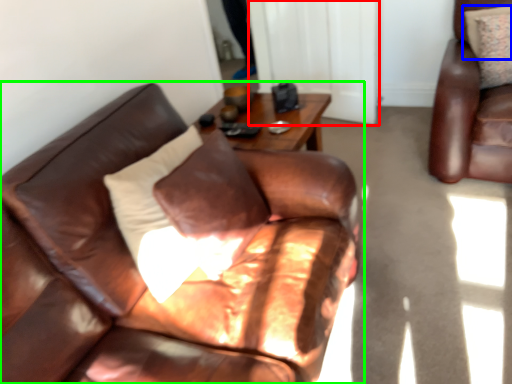
Question: Based on their relative distances, which object is farther from glass door (highlighted by a red box)? Choose from pillow (highlighted by a blue box) and studio couch (highlighted by a green box).

Choices:
 (A) pillow
 (B) studio couch

Answer: (B)